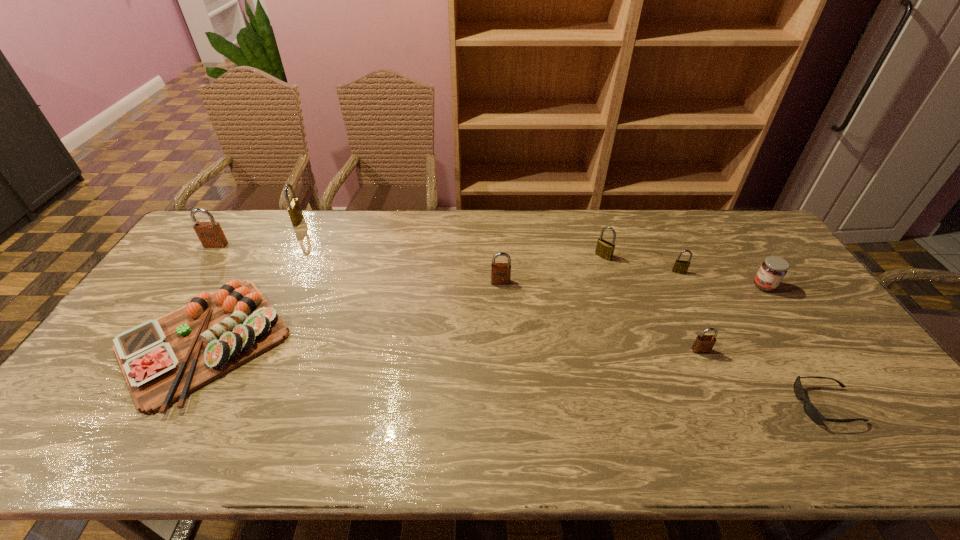
Locate an element on the screen. This screenshot has height=540, width=960. the rightmost brass padlock is located at coordinates (681, 267).

The height and width of the screenshot is (540, 960). In order to click on the rightmost brown padlock in this screenshot , I will do `click(703, 343)`.

Locate an element on the screen. The width and height of the screenshot is (960, 540). the second padlock from right to left is located at coordinates (703, 343).

The height and width of the screenshot is (540, 960). Identify the location of the second shortest object. (163, 360).

At what (x,y) coordinates should I click in order to perform the action: click on the shortest object. Please return your answer as a coordinate pair (x, y). Looking at the image, I should click on (x=811, y=411).

Where is `free space located 0.090m on the front of the farthest brass padlock`? Image resolution: width=960 pixels, height=540 pixels. free space located 0.090m on the front of the farthest brass padlock is located at coordinates (287, 242).

Locate an element on the screen. The image size is (960, 540). vacant region located on the front-facing side of the farthest brown padlock is located at coordinates (190, 282).

Image resolution: width=960 pixels, height=540 pixels. I want to click on free space located 0.370m on the front-facing side of the sixth object from right to left, so pos(506,387).

You are a GUI agent. You are given a task and a screenshot of the screen. Output one action in this format:
    pyautogui.click(x=<x>, y=<y>)
    Task: Click on the vacant region located 0.090m on the back of the second farthest brass padlock
    The image size is (960, 540).
    Given the screenshot: What is the action you would take?
    pyautogui.click(x=597, y=235)

Where is `blank space located 0.340m on the left of the jam`? This screenshot has width=960, height=540. blank space located 0.340m on the left of the jam is located at coordinates (643, 286).